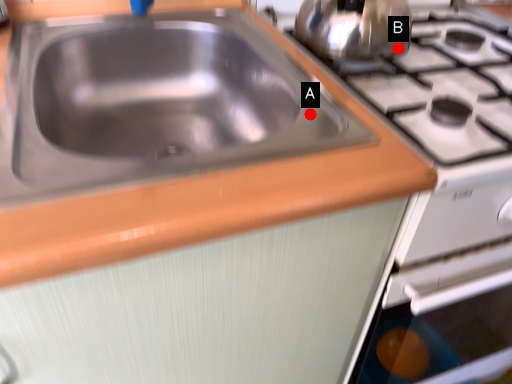
Question: Two points are circled on the image, labeled by A and B beside each circle. Which point is closer to the camera?

Choices:
 (A) A is closer
 (B) B is closer

Answer: (A)